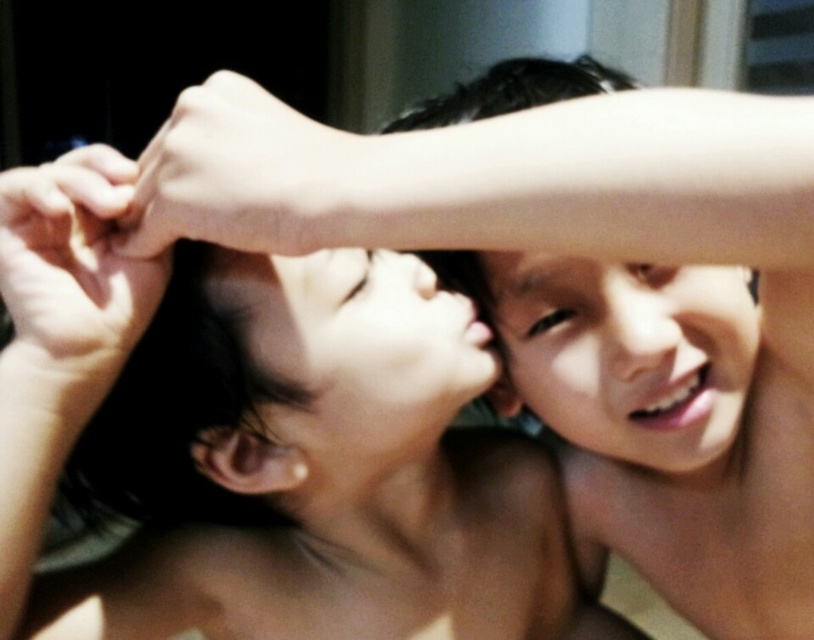
Does smooth skin face at upper center appear under smooth skin face at center?

Indeed, smooth skin face at upper center is positioned under smooth skin face at center.

Describe the element at coordinates (627, 355) in the screenshot. The height and width of the screenshot is (640, 814). I see `smooth skin face at upper center` at that location.

I want to click on smooth skin face at upper center, so click(627, 355).